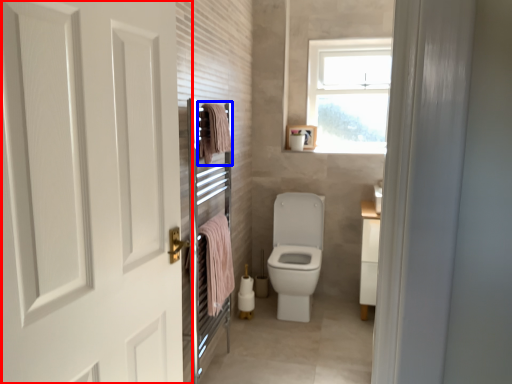
Question: Which point is further to the camera, door (highlighted by a red box) or bath towel (highlighted by a blue box)?

Choices:
 (A) door
 (B) bath towel

Answer: (B)